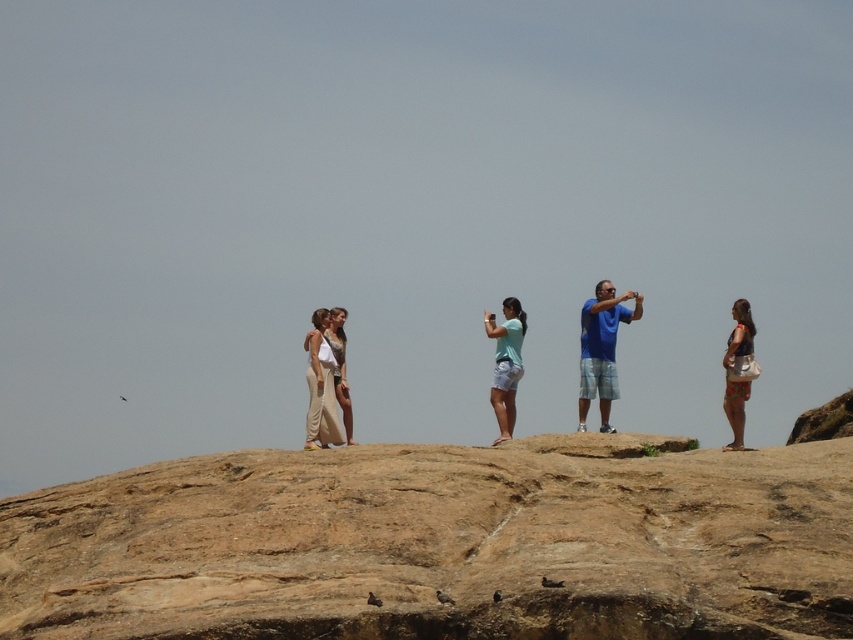
Question: Which object is the closest to the brown rock cliff at center?

Choices:
 (A) light blue fabric at center
 (B) floral print shorts at right

Answer: (B)

Question: Can you confirm if brown rock cliff at center is smaller than blue cotton shirt at center?

Choices:
 (A) yes
 (B) no

Answer: (B)

Question: Can you confirm if brown rock cliff at center is smaller than light blue fabric at center?

Choices:
 (A) no
 (B) yes

Answer: (A)

Question: Which point is farther from the camera taking this photo?

Choices:
 (A) (605, 452)
 (B) (605, 356)
 (C) (751, 346)

Answer: (B)

Question: Which object is farther from the camera taking this photo?

Choices:
 (A) floral print shorts at right
 (B) brown rock cliff at center
 (C) light blue fabric at center

Answer: (C)

Question: Is brown rock cliff at center positioned behind blue cotton shirt at center?

Choices:
 (A) yes
 (B) no

Answer: (B)